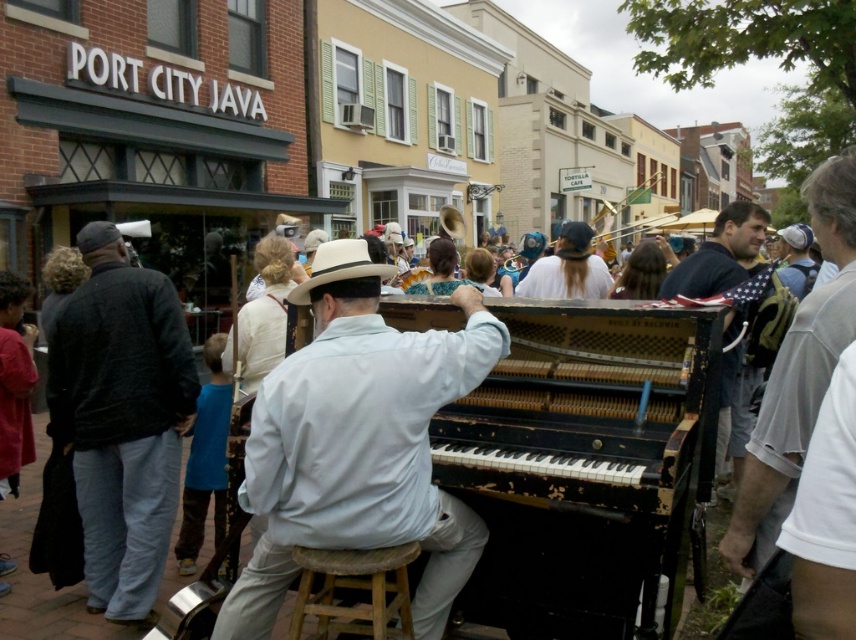
You are standing at the entrance of the street and want to find the black distressed piano at center. According to the coordinates provided, in which direction should you walk to reach it?

The black distressed piano at center is located at coordinates point (583, 464), so you should walk towards the center of the image to reach it.

You are standing at the entrance of the street where the lively scene is happening. You notice a person wearing a white cotton shirt at center. If you walk straight ahead, will this person come into your line of sight before or after passing the old, black upright piano?

The white cotton shirt at center is located at point (568, 268), which is in the foreground near the piano. Since you are starting at the entrance and walking straight ahead, the white cotton shirt at center would come into your line of sight before passing the piano as it is positioned closer to the entrance compared to the piano.

You are attending a street festival and notice a black distressed piano at center and a light blue cotton shirt at center. From your perspective, which object is located to the right of the other?

The black distressed piano at center is positioned on the right side of light blue cotton shirt at center, so the piano is to the right of the shirt.